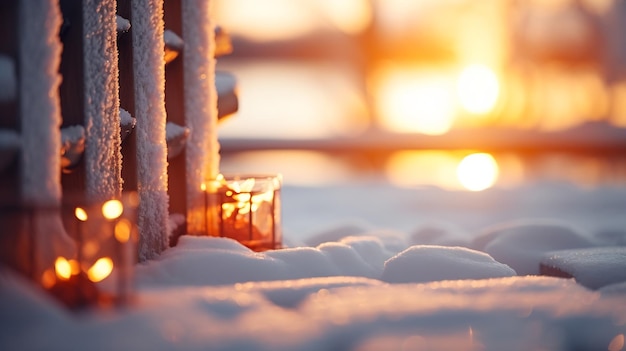
Where is `yellow light`? yellow light is located at coordinates (412, 111), (474, 102), (488, 43), (473, 167).